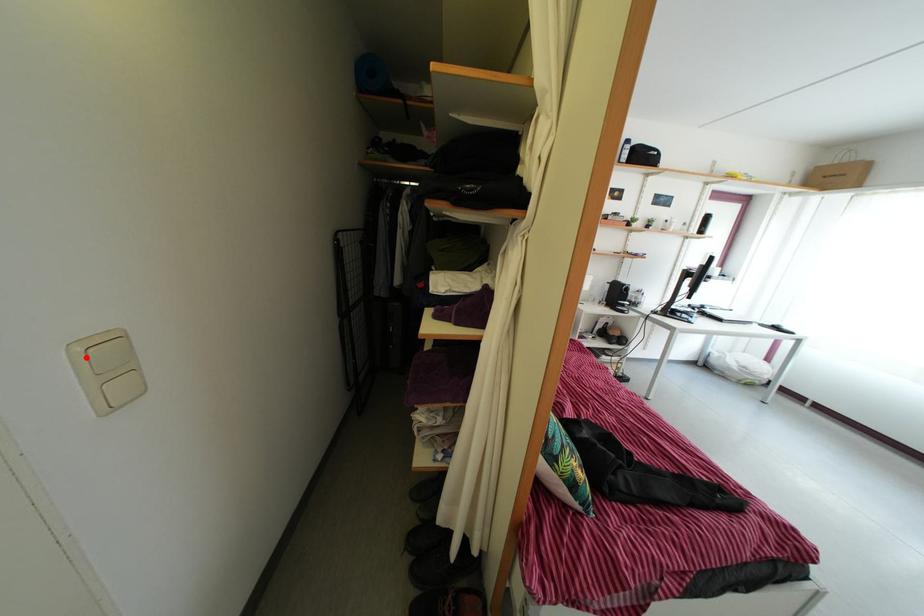
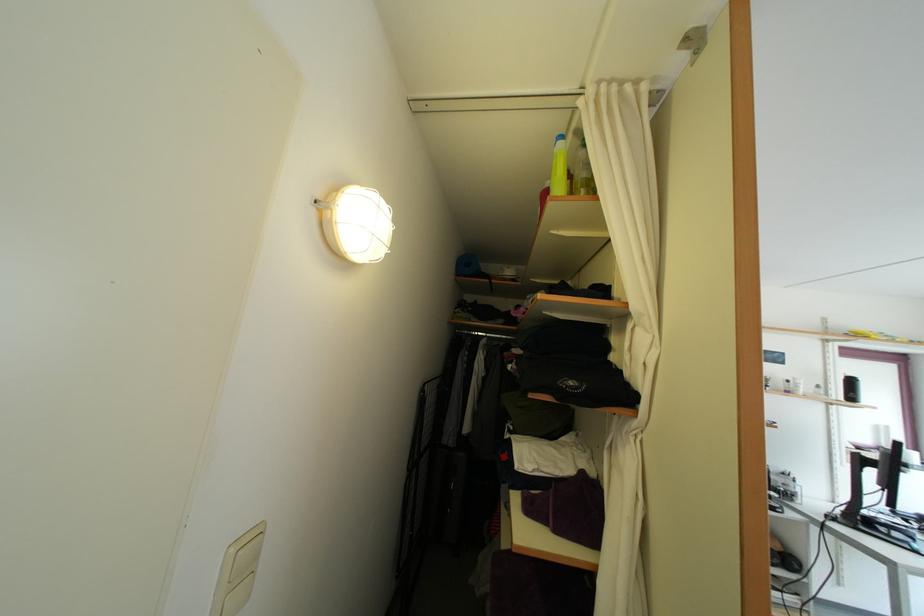
Find the pixel in the second image that matches the highlighted location in the first image.

(239, 559)